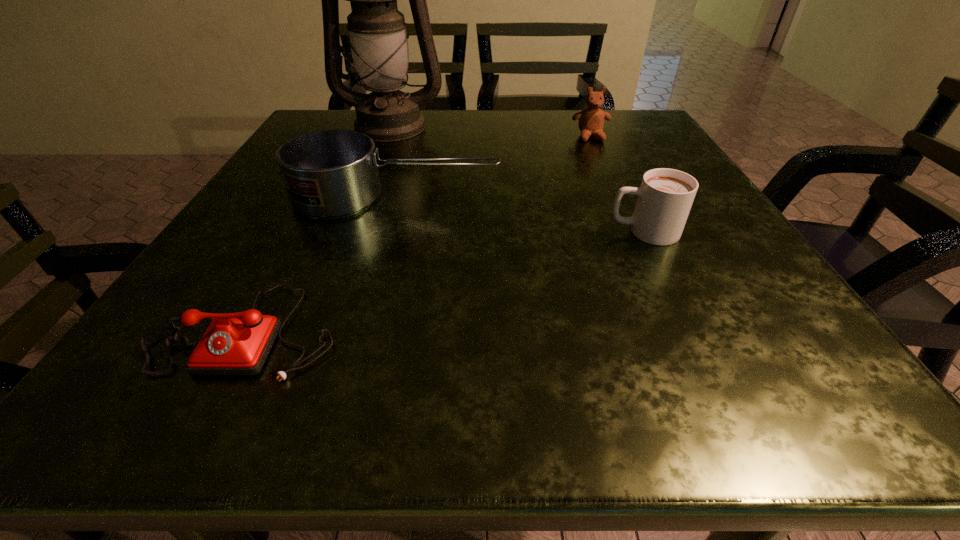
The image size is (960, 540). I want to click on oil lamp, so click(x=377, y=30).

At what (x,y) coordinates should I click in order to perform the action: click on teddy bear. Please return your answer as a coordinate pair (x, y). Image resolution: width=960 pixels, height=540 pixels. Looking at the image, I should click on (591, 120).

The width and height of the screenshot is (960, 540). I want to click on saucepan, so click(333, 173).

You are a GUI agent. You are given a task and a screenshot of the screen. Output one action in this format:
    pyautogui.click(x=<x>, y=<y>)
    Task: Click on the cappuccino
    This screenshot has height=540, width=960.
    Given the screenshot: What is the action you would take?
    pyautogui.click(x=665, y=196)

The width and height of the screenshot is (960, 540). I want to click on telephone, so click(238, 343).

Where is `the shortest object`? This screenshot has width=960, height=540. the shortest object is located at coordinates (238, 343).

This screenshot has height=540, width=960. What are the coordinates of `free space located on the front of the tallest object` in the screenshot? It's located at (380, 154).

Identify the location of vacant point located 0.350m on the face of the teddy bear. The height and width of the screenshot is (540, 960). (634, 233).

Where is `free location located with the handle extending from one side of the saucepan`? This screenshot has height=540, width=960. free location located with the handle extending from one side of the saucepan is located at coordinates (643, 196).

Locate an element on the screen. Image resolution: width=960 pixels, height=540 pixels. blank space located on the side with the handle of the cappuccino is located at coordinates (541, 232).